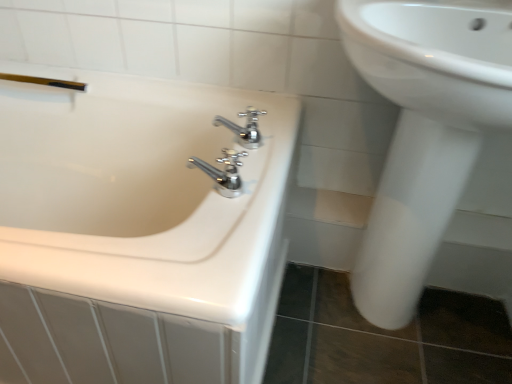
Identify the location of free space in front of chrome metallic faucet at center, arranged as the first tap when viewed from the top. (248, 178).